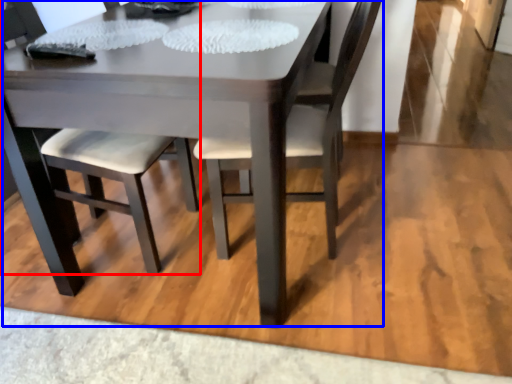
Question: Which point is further to the camera, chair (highlighted by a red box) or kitchen & dining room table (highlighted by a blue box)?

Choices:
 (A) chair
 (B) kitchen & dining room table

Answer: (A)